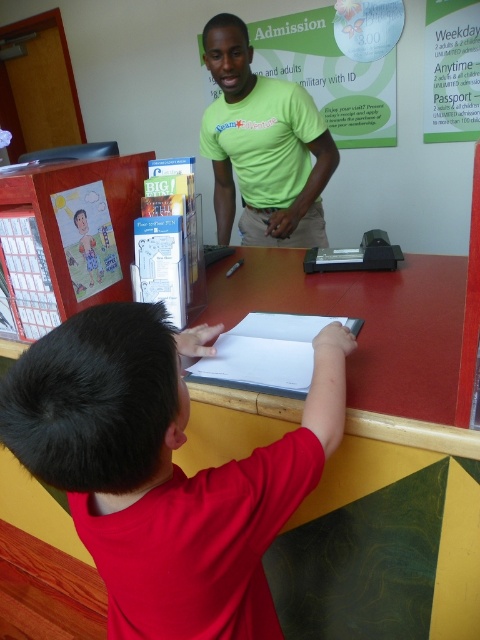
Who is positioned more to the right, red matte shirt at lower left or green matte shirt at center?

Positioned to the right is green matte shirt at center.

Is red matte shirt at lower left thinner than green matte shirt at center?

Correct, red matte shirt at lower left's width is less than green matte shirt at center's.

Is point (149, 392) positioned in front of point (272, 224)?

Yes, it is.

The width and height of the screenshot is (480, 640). What are the coordinates of `red matte shirt at lower left` in the screenshot? It's located at (164, 468).

Does point (132, 352) come behind point (72, 225)?

No, (132, 352) is in front of (72, 225).

Between red matte shirt at lower left and wooden desk at left, which one is positioned lower?

Positioned lower is red matte shirt at lower left.

Locate an element on the screen. Image resolution: width=480 pixels, height=640 pixels. red matte shirt at lower left is located at coordinates (164, 468).

Is green matte shirt at center positioned in front of wooden desk at left?

No, it is not.

Based on the photo, is green matte shirt at center further to the viewer compared to wooden desk at left?

Yes, green matte shirt at center is further from the viewer.

Is point (240, 216) farther from camera compared to point (54, 308)?

Yes, point (240, 216) is farther from viewer.

At what (x,y) coordinates should I click in order to perform the action: click on green matte shirt at center. Please return your answer as a coordinate pair (x, y). The height and width of the screenshot is (640, 480). Looking at the image, I should click on (263, 147).